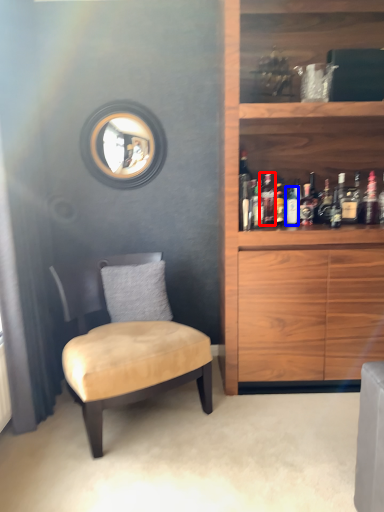
Question: Among these objects, which one is farthest to the camera, bottle (highlighted by a red box) or bottle (highlighted by a blue box)?

Choices:
 (A) bottle
 (B) bottle

Answer: (B)